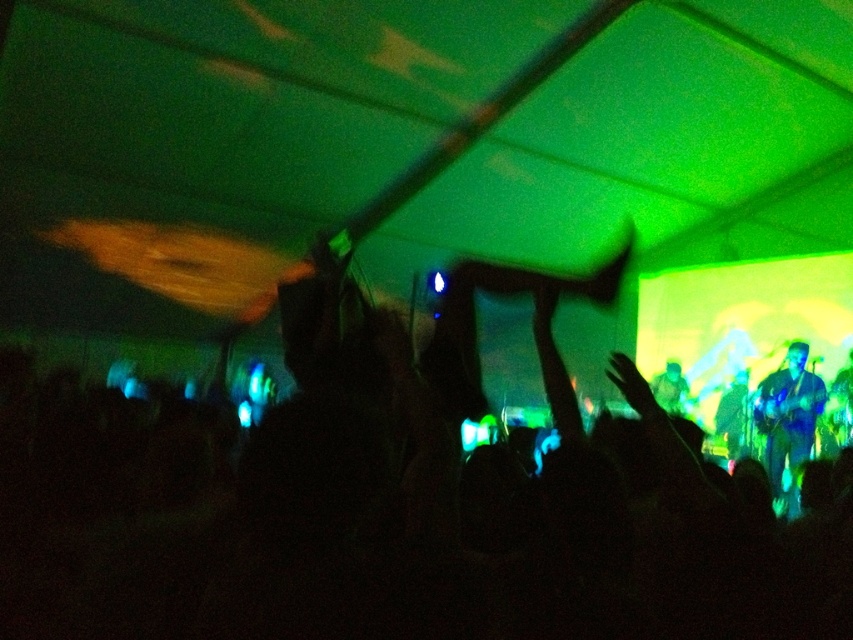
Who is positioned more to the left, silhouette of person at center or blue metallic guitar at right?

silhouette of person at center is more to the left.

I want to click on silhouette of person at center, so click(x=397, y=502).